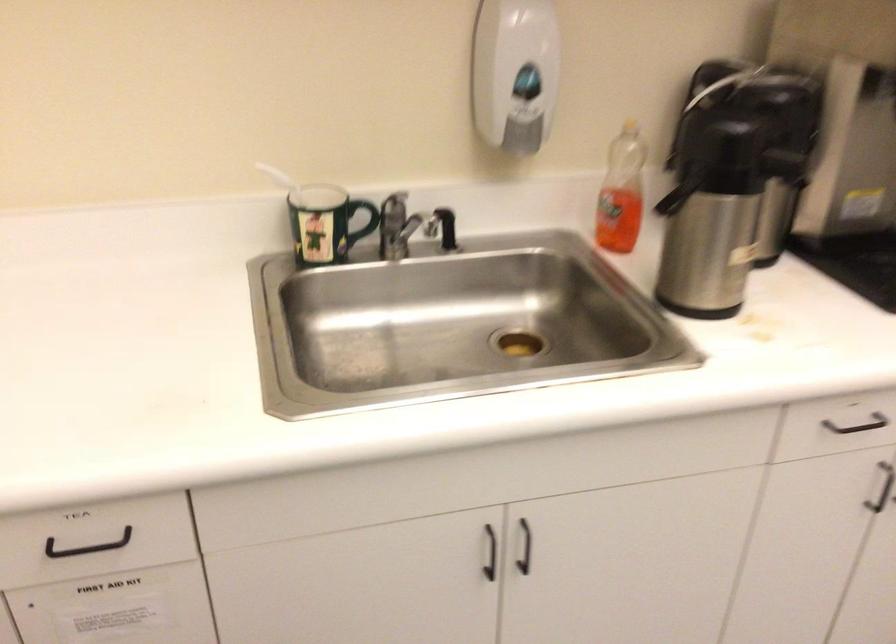
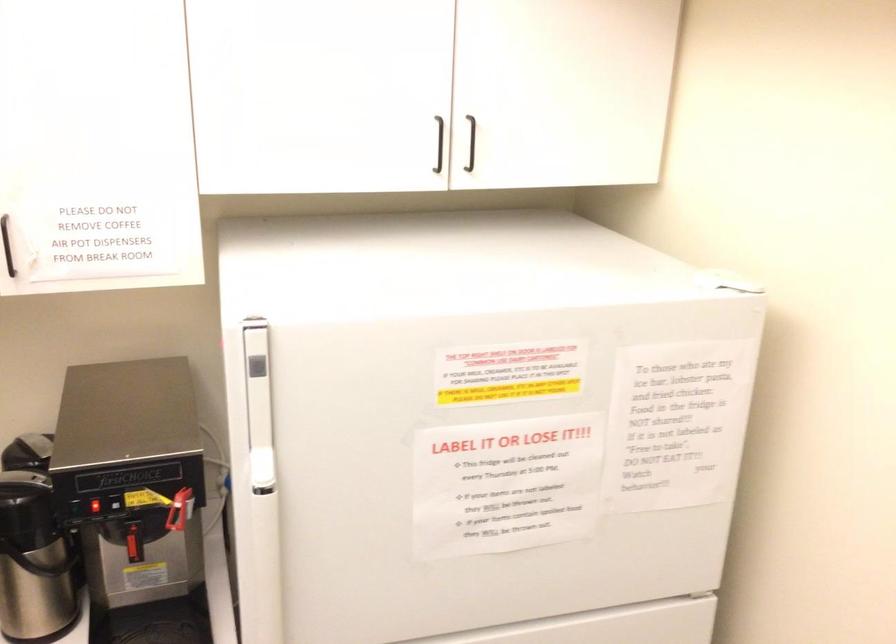
Question: What movement of the cameraman would produce the second image?

Choices:
 (A) Left
 (B) Right
 (C) Forward
 (D) Backward

Answer: (B)